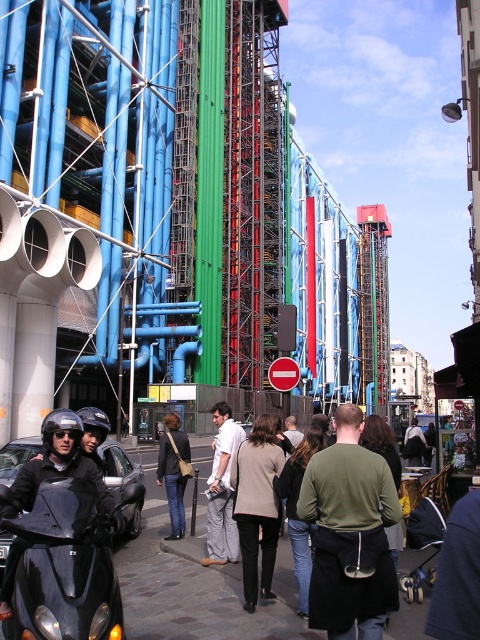
Is white cotton shirt at center closer to camera compared to denim jacket at center?

Yes, white cotton shirt at center is closer to the viewer.

Which is behind, point (220, 554) or point (158, 445)?

The point (158, 445) is behind.

Is point (227, 477) closer to viewer compared to point (162, 452)?

That is True.

Where is `white cotton shirt at center`? The height and width of the screenshot is (640, 480). white cotton shirt at center is located at coordinates (222, 490).

In the scene shown: Who is taller, green matte shirt at center or white cotton shirt at center?

Standing taller between the two is green matte shirt at center.

Who is shorter, green matte shirt at center or white cotton shirt at center?

white cotton shirt at center

Where is `green matte shirt at center`? The width and height of the screenshot is (480, 640). green matte shirt at center is located at coordinates (349, 532).

At what (x,y) coordinates should I click in order to perform the action: click on green matte shirt at center. Please return your answer as a coordinate pair (x, y). The width and height of the screenshot is (480, 640). Looking at the image, I should click on (349, 532).

Does shiny black scooter at lower left lie behind denim jacket at center?

That is False.

Image resolution: width=480 pixels, height=640 pixels. Describe the element at coordinates (90, 433) in the screenshot. I see `shiny black scooter at lower left` at that location.

The image size is (480, 640). I want to click on shiny black scooter at lower left, so click(x=90, y=433).